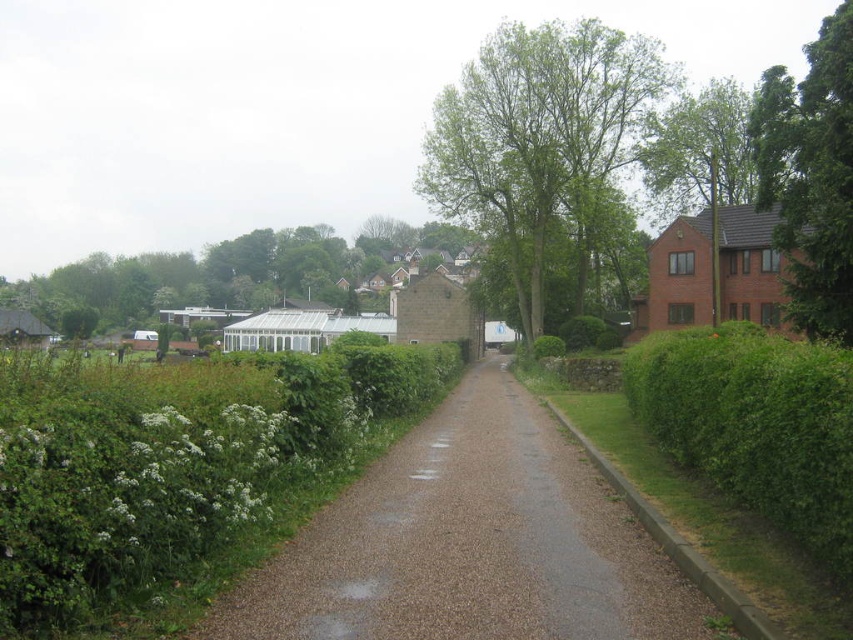
Question: Among these points, which one is nearest to the camera?

Choices:
 (A) (90, 378)
 (B) (750, 100)
 (C) (780, 120)

Answer: (A)

Question: Which object is closer to the camera taking this photo?

Choices:
 (A) green leafy tree at right
 (B) green leafy hedge at right
 (C) brown gravel driveway at center

Answer: (B)

Question: Does brown gravel driveway at center appear over green leafy tree at center?

Choices:
 (A) no
 (B) yes

Answer: (A)

Question: Which of the following is the closest to the observer?

Choices:
 (A) (808, 269)
 (B) (555, 129)
 (C) (328, 452)

Answer: (C)

Question: Is green leafy hedge at center to the right of green leafy hedge at right from the viewer's perspective?

Choices:
 (A) no
 (B) yes

Answer: (A)

Question: Does green leafy hedge at center have a greater width compared to green leafy tree at center?

Choices:
 (A) yes
 (B) no

Answer: (B)